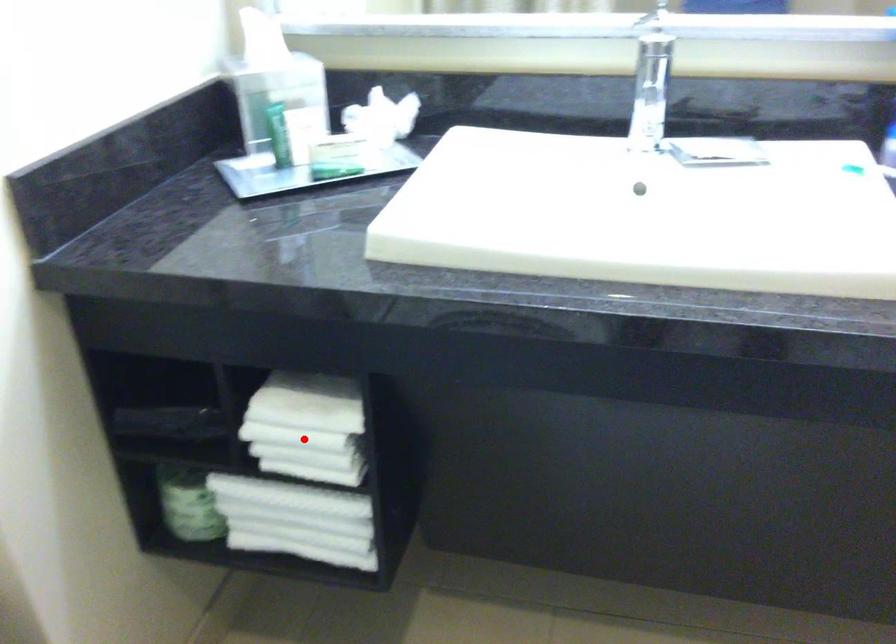
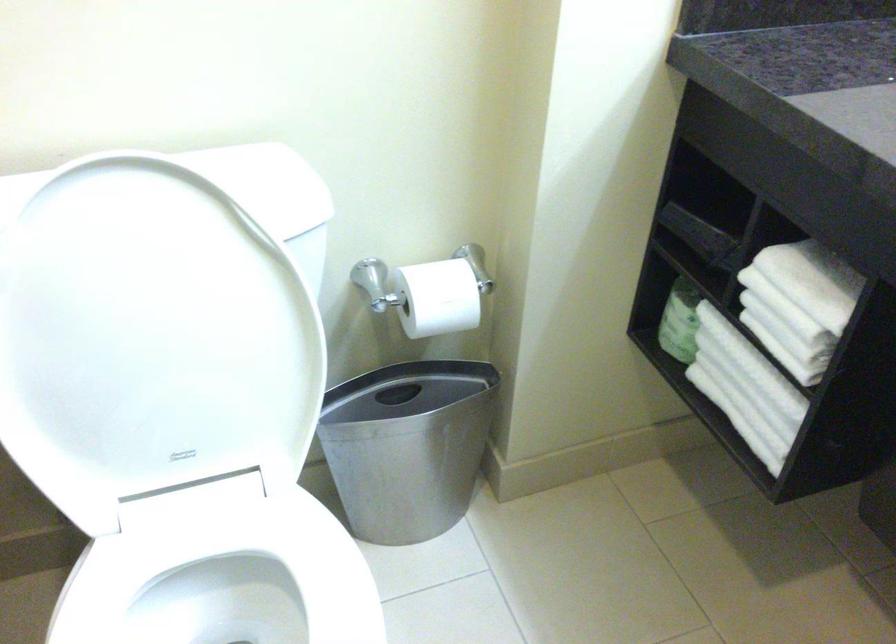
Where in the second image is the point corresponding to the highlighted location from the first image?

(785, 308)